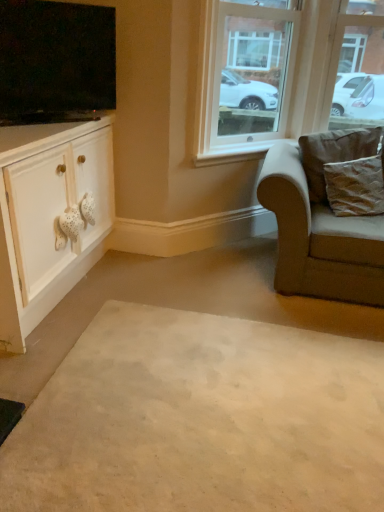
Question: Does white matte cabinet at left appear on the left side of flat screen tv at upper left?

Choices:
 (A) yes
 (B) no

Answer: (A)

Question: Can you see white matte cabinet at left touching flat screen tv at upper left?

Choices:
 (A) no
 (B) yes

Answer: (A)

Question: Is white matte cabinet at left positioned behind flat screen tv at upper left?

Choices:
 (A) yes
 (B) no

Answer: (B)

Question: Considering the relative sizes of white matte cabinet at left and flat screen tv at upper left in the image provided, is white matte cabinet at left bigger than flat screen tv at upper left?

Choices:
 (A) no
 (B) yes

Answer: (B)

Question: From the image's perspective, is white matte cabinet at left on top of flat screen tv at upper left?

Choices:
 (A) yes
 (B) no

Answer: (B)

Question: From their relative heights in the image, would you say beige fabric chair at right is taller or shorter than white matte cabinet at left?

Choices:
 (A) tall
 (B) short

Answer: (B)

Question: Is point tap(339, 249) positioned closer to the camera than point tap(36, 202)?

Choices:
 (A) closer
 (B) farther

Answer: (B)

Question: Is beige fabric chair at right bigger or smaller than white matte cabinet at left?

Choices:
 (A) big
 (B) small

Answer: (A)

Question: In the image, is beige fabric chair at right positioned in front of or behind white matte cabinet at left?

Choices:
 (A) front
 (B) behind

Answer: (B)

Question: In the image, is brown textured pillow at right, the second pillow positioned from the bottom, on the left side or the right side of clear glass window at upper center?

Choices:
 (A) right
 (B) left

Answer: (A)

Question: From the image's perspective, is brown textured pillow at right, placed as the first pillow when sorted from top to bottom, above or below clear glass window at upper center?

Choices:
 (A) above
 (B) below

Answer: (B)

Question: Is brown textured pillow at right, the second pillow positioned from the bottom, situated inside clear glass window at upper center or outside?

Choices:
 (A) inside
 (B) outside

Answer: (B)

Question: In terms of height, does brown textured pillow at right, the second pillow positioned from the bottom, look taller or shorter compared to clear glass window at upper center?

Choices:
 (A) tall
 (B) short

Answer: (B)

Question: In terms of height, does beige carpet at center look taller or shorter compared to beige fabric chair at right?

Choices:
 (A) short
 (B) tall

Answer: (A)

Question: Is beige carpet at center spatially inside beige fabric chair at right, or outside of it?

Choices:
 (A) inside
 (B) outside

Answer: (B)